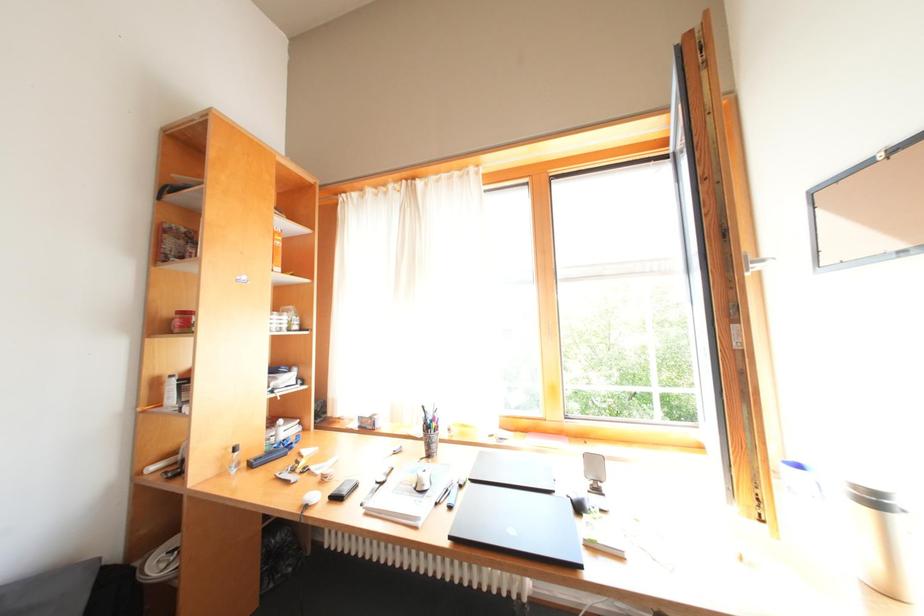
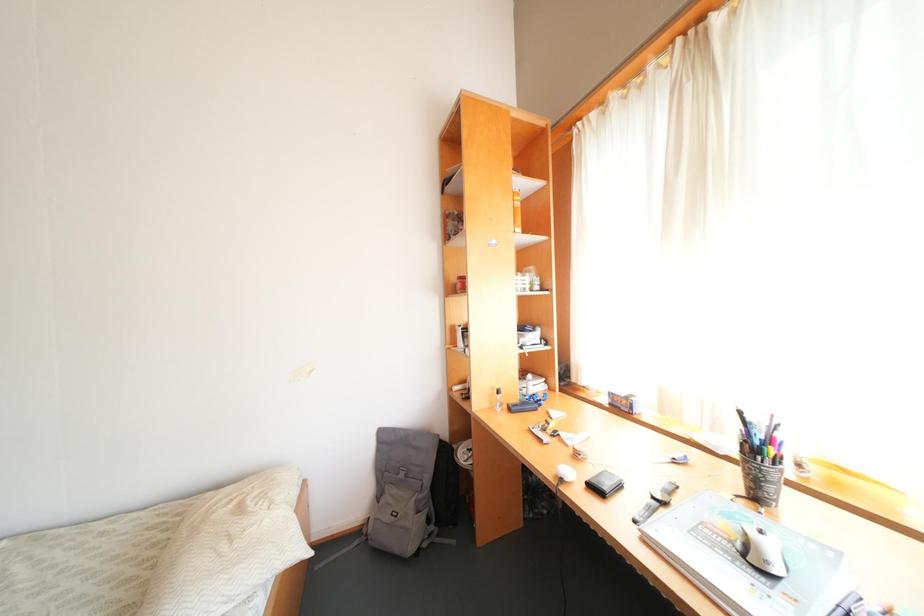
Question: Based on the continuous images, in which direction is the camera rotating? Reply with the corresponding letter.

Choices:
 (A) Left
 (B) Right
 (C) Up
 (D) Down

Answer: (A)